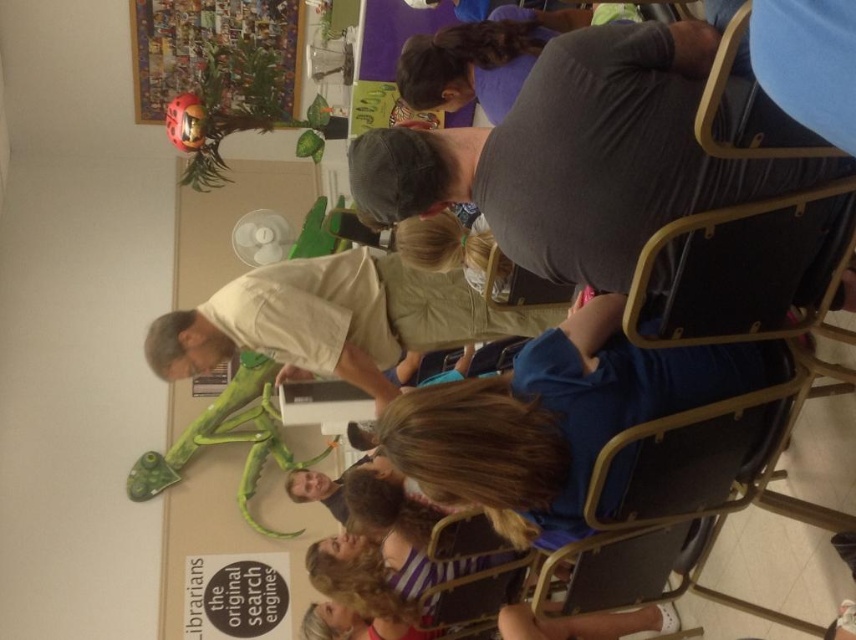
In the scene described, where is the gray cotton shirt at upper center located relative to the light beige shirt at center?

The gray cotton shirt at upper center is to the right of the light beige shirt at center.

You are a photographer trying to capture a group photo of the gray cotton shirt at upper center and the metallic silver puzzle at upper left. Based on their positions, which object should you focus on first to ensure both are in frame?

The gray cotton shirt at upper center is not as tall as the metallic silver puzzle at upper left, so you should focus on the metallic silver puzzle at upper left first to ensure both are in frame.